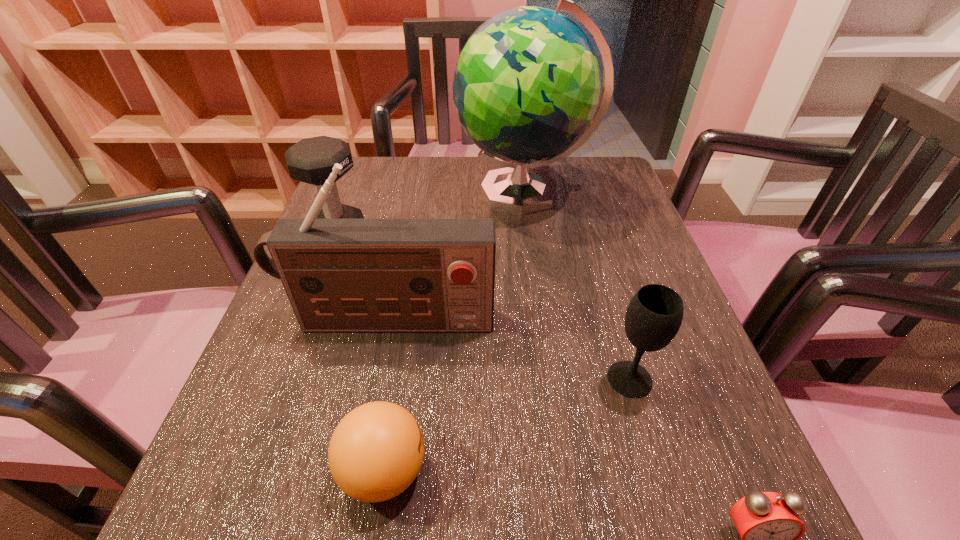
Find the location of a particular element. object at the far right corner is located at coordinates (526, 86).

Find the location of a particular element. free space at the far edge of the desktop is located at coordinates [436, 187].

Identify the location of vacant space at the near edge of the desktop. The height and width of the screenshot is (540, 960). (630, 526).

This screenshot has width=960, height=540. In the image, there is a desktop. What are the coordinates of `vacant space at the left edge` in the screenshot? It's located at (334, 389).

Image resolution: width=960 pixels, height=540 pixels. I want to click on vacant area at the right edge, so click(570, 222).

I want to click on vacant space at the far left corner of the desktop, so click(372, 158).

Where is `vacant space at the far right corner of the desktop`? This screenshot has height=540, width=960. vacant space at the far right corner of the desktop is located at coordinates (605, 197).

Find the location of `blank region between the radio receiver and the fourth tallest object`. blank region between the radio receiver and the fourth tallest object is located at coordinates (510, 350).

This screenshot has width=960, height=540. I want to click on free area in between the radio receiver and the fourth farthest object, so click(x=510, y=350).

The image size is (960, 540). In order to click on free space between the dumbbell and the second shortest object in this screenshot , I will do `click(362, 353)`.